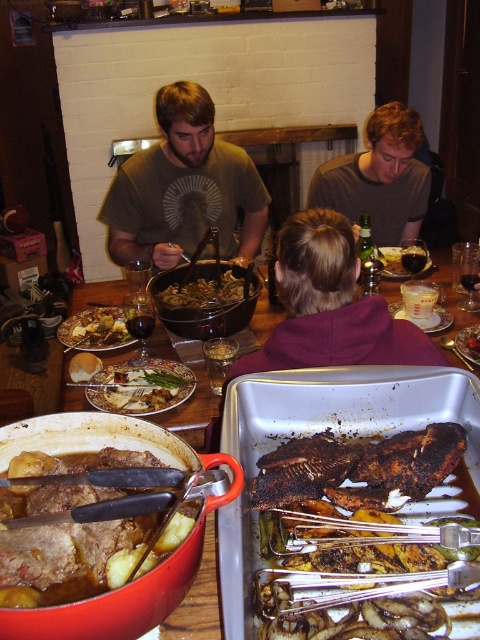
Who is higher up, meaty brown stew at center or matte gray shirt at upper center?

matte gray shirt at upper center is above.

Can you confirm if meaty brown stew at center is positioned to the right of matte gray shirt at upper center?

In fact, meaty brown stew at center is to the left of matte gray shirt at upper center.

Is point (118, 452) in front of point (364, 198)?

Yes, it is in front of point (364, 198).

Locate an element on the screen. The width and height of the screenshot is (480, 640). meaty brown stew at center is located at coordinates (68, 561).

Is matte brown shirt at center to the right of golden brown mashed potatoes at center from the viewer's perspective?

Correct, you'll find matte brown shirt at center to the right of golden brown mashed potatoes at center.

Which of these two, matte brown shirt at center or golden brown mashed potatoes at center, stands taller?

matte brown shirt at center

Where is `matte brown shirt at center`? matte brown shirt at center is located at coordinates (183, 188).

Is matte gray shirt at upper center bigger than dark brown crispy meat at center?

Indeed, matte gray shirt at upper center has a larger size compared to dark brown crispy meat at center.

Which is in front, point (415, 132) or point (386, 273)?

Point (415, 132) is more forward.

At what (x,y) coordinates should I click in order to perform the action: click on matte gray shirt at upper center. Please return your answer as a coordinate pair (x, y). This screenshot has width=480, height=640. Looking at the image, I should click on (379, 177).